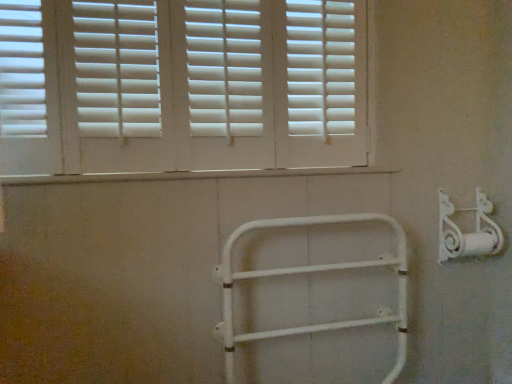
Question: Is white matte shutters at upper center turned away from white matte bracket at right?

Choices:
 (A) yes
 (B) no

Answer: (B)

Question: Is white matte shutters at upper center not inside white matte bracket at right?

Choices:
 (A) yes
 (B) no

Answer: (A)

Question: Would you say white matte shutters at upper center is a long distance from white matte bracket at right?

Choices:
 (A) yes
 (B) no

Answer: (B)

Question: From a real-world perspective, is white matte shutters at upper center on white matte bracket at right?

Choices:
 (A) no
 (B) yes

Answer: (B)

Question: Considering the relative sizes of white matte shutters at upper center and white matte bracket at right in the image provided, is white matte shutters at upper center thinner than white matte bracket at right?

Choices:
 (A) yes
 (B) no

Answer: (A)

Question: Considering the positions of white matte shutters at upper center and white matte metal rail at center in the image, is white matte shutters at upper center bigger or smaller than white matte metal rail at center?

Choices:
 (A) small
 (B) big

Answer: (B)

Question: Is white matte shutters at upper center situated inside white matte metal rail at center or outside?

Choices:
 (A) inside
 (B) outside

Answer: (B)

Question: Is point (96, 140) closer or farther from the camera than point (226, 354)?

Choices:
 (A) farther
 (B) closer

Answer: (B)

Question: In terms of height, does white matte shutters at upper center look taller or shorter compared to white matte metal rail at center?

Choices:
 (A) short
 (B) tall

Answer: (A)

Question: Is point [x=471, y=256] closer or farther from the camera than point [x=138, y=94]?

Choices:
 (A) closer
 (B) farther

Answer: (B)

Question: Looking at their shapes, would you say white matte bracket at right is wider or thinner than white matte shutters at upper center?

Choices:
 (A) thin
 (B) wide

Answer: (B)

Question: From a real-world perspective, is white matte bracket at right physically located above or below white matte shutters at upper center?

Choices:
 (A) below
 (B) above

Answer: (A)

Question: In terms of size, does white matte bracket at right appear bigger or smaller than white matte shutters at upper center?

Choices:
 (A) big
 (B) small

Answer: (B)

Question: In terms of height, does white matte metal rail at center look taller or shorter compared to white matte shutters at upper center?

Choices:
 (A) short
 (B) tall

Answer: (B)

Question: Is white matte metal rail at center wider or thinner than white matte shutters at upper center?

Choices:
 (A) thin
 (B) wide

Answer: (B)